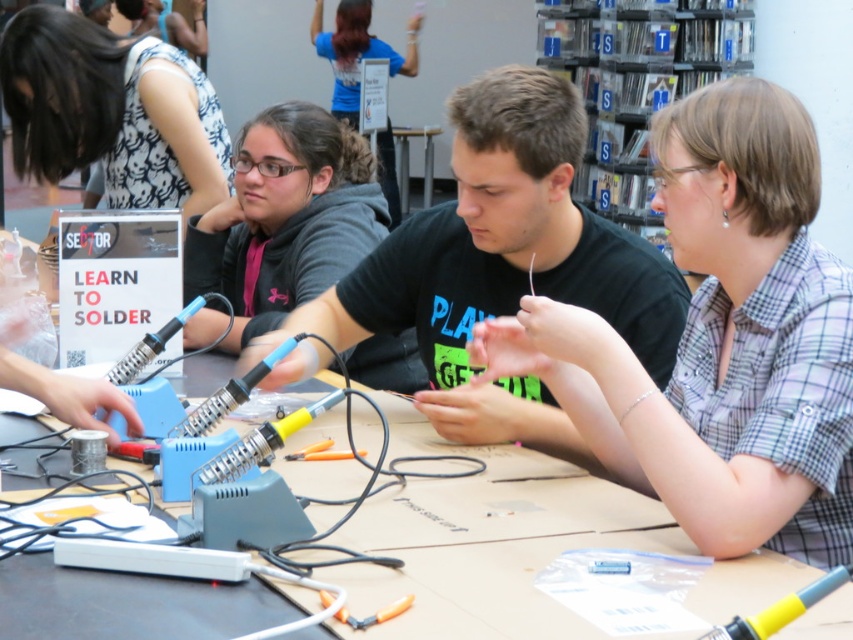
Who is higher up, wooden table at center or white printed dress at upper left?

white printed dress at upper left is above.

Does wooden table at center have a lesser width compared to white printed dress at upper left?

In fact, wooden table at center might be wider than white printed dress at upper left.

What do you see at coordinates (490, 547) in the screenshot?
I see `wooden table at center` at bounding box center [490, 547].

The width and height of the screenshot is (853, 640). In order to click on wooden table at center in this screenshot , I will do `click(490, 547)`.

Which is above, plaid cotton shirt at center or white printed dress at upper left?

white printed dress at upper left is higher up.

Between plaid cotton shirt at center and white printed dress at upper left, which one has less height?

white printed dress at upper left is shorter.

Is point (721, 516) positioned behind point (161, 170)?

No.

Image resolution: width=853 pixels, height=640 pixels. Identify the location of plaid cotton shirt at center. (721, 340).

Is plaid cotton shirt at center smaller than black matte t-shirt at center?

Yes, plaid cotton shirt at center is smaller than black matte t-shirt at center.

Is plaid cotton shirt at center wider than black matte t-shirt at center?

No.

Find the location of `plaid cotton shirt at center`. plaid cotton shirt at center is located at coordinates [721, 340].